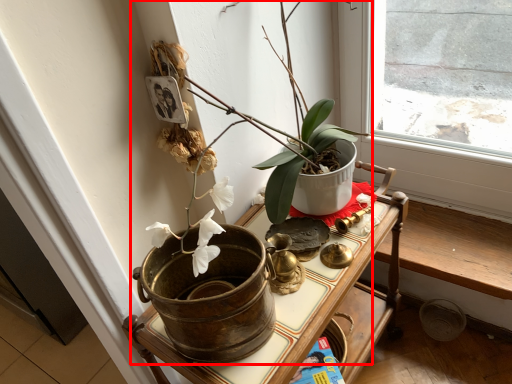
Question: From the image's perspective, considering the relative positions of houseplant (annotated by the red box) and table in the image provided, where is houseplant (annotated by the red box) located with respect to the staircase?

Choices:
 (A) above
 (B) below

Answer: (A)